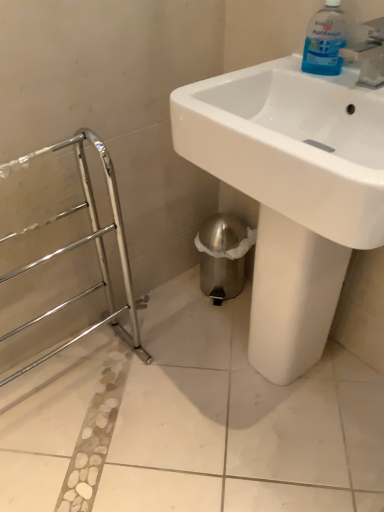
Where is `white glossy sink at center`? Image resolution: width=384 pixels, height=512 pixels. white glossy sink at center is located at coordinates (292, 191).

The height and width of the screenshot is (512, 384). Describe the element at coordinates (292, 191) in the screenshot. I see `white glossy sink at center` at that location.

Measure the distance between point (230, 102) and camera.

Point (230, 102) and camera are 37.72 inches apart from each other.

Describe the element at coordinates (325, 41) in the screenshot. This screenshot has width=384, height=512. I see `blue translucent plastic handwash at upper right` at that location.

In order to face blue translucent plastic handwash at upper right, should I rotate leftwards or rightwards?

You should look right and rotate roughly 17.604 degrees.

Measure the distance between point (337,19) and camera.

Point (337,19) and camera are 95.20 centimeters apart.

At what (x,y) coordinates should I click in order to perform the action: click on blue translucent plastic handwash at upper right. Please return your answer as a coordinate pair (x, y). Looking at the image, I should click on (325, 41).

Find the location of `white glossy sink at center`. white glossy sink at center is located at coordinates (292, 191).

Considering the positions of objects white glossy sink at center and blue translucent plastic handwash at upper right in the image provided, who is more to the right, white glossy sink at center or blue translucent plastic handwash at upper right?

From the viewer's perspective, blue translucent plastic handwash at upper right appears more on the right side.

Is white glossy sink at center further to camera compared to blue translucent plastic handwash at upper right?

No, white glossy sink at center is closer to the viewer.

Does point (235, 162) come closer to viewer compared to point (339, 34)?

That is True.

Looking at this image, from the image's perspective, is white glossy sink at center on top of blue translucent plastic handwash at upper right?

No, from the image's perspective, white glossy sink at center is not over blue translucent plastic handwash at upper right.

From a real-world perspective, who is located higher, white glossy sink at center or blue translucent plastic handwash at upper right?

In real-world perspective, blue translucent plastic handwash at upper right is above.

Considering the relative sizes of white glossy sink at center and blue translucent plastic handwash at upper right in the image provided, is white glossy sink at center wider than blue translucent plastic handwash at upper right?

Indeed, white glossy sink at center has a greater width compared to blue translucent plastic handwash at upper right.

Which of these two, white glossy sink at center or blue translucent plastic handwash at upper right, stands shorter?

blue translucent plastic handwash at upper right is shorter.

Between white glossy sink at center and blue translucent plastic handwash at upper right, which one has smaller size?

Smaller between the two is blue translucent plastic handwash at upper right.

Is blue translucent plastic handwash at upper right completely or partially inside white glossy sink at center?

Yes, blue translucent plastic handwash at upper right is inside white glossy sink at center.

Are white glossy sink at center and blue translucent plastic handwash at upper right making contact?

No, white glossy sink at center is not touching blue translucent plastic handwash at upper right.

Does white glossy sink at center turn towards blue translucent plastic handwash at upper right?

No, white glossy sink at center is not facing towards blue translucent plastic handwash at upper right.

You are a GUI agent. You are given a task and a screenshot of the screen. Output one action in this format:
    pyautogui.click(x=<x>, y=<y>)
    Task: Click on the cleaning product on the right of white glossy sink at center
    This screenshot has width=384, height=512.
    Given the screenshot: What is the action you would take?
    pyautogui.click(x=325, y=41)

Can you confirm if blue translucent plastic handwash at upper right is positioned to the left of white glossy sink at center?

Incorrect, blue translucent plastic handwash at upper right is not on the left side of white glossy sink at center.

Does blue translucent plastic handwash at upper right come behind white glossy sink at center?

Yes, it is.

Which is in front, point (333, 42) or point (343, 226)?

The point (343, 226) is in front.

From the image's perspective, is blue translucent plastic handwash at upper right above or below white glossy sink at center?

blue translucent plastic handwash at upper right is above white glossy sink at center.

From a real-world perspective, which is physically below, blue translucent plastic handwash at upper right or white glossy sink at center?

From a 3D spatial view, white glossy sink at center is below.

Is blue translucent plastic handwash at upper right wider or thinner than white glossy sink at center?

In the image, blue translucent plastic handwash at upper right appears to be more narrow than white glossy sink at center.

Considering the sizes of objects blue translucent plastic handwash at upper right and white glossy sink at center in the image provided, who is taller, blue translucent plastic handwash at upper right or white glossy sink at center?

Standing taller between the two is white glossy sink at center.

From the picture: Who is smaller, blue translucent plastic handwash at upper right or white glossy sink at center?

blue translucent plastic handwash at upper right is smaller.

Is blue translucent plastic handwash at upper right not inside white glossy sink at center?

No, blue translucent plastic handwash at upper right is not entirely external to white glossy sink at center.

Is blue translucent plastic handwash at upper right placed right next to white glossy sink at center?

blue translucent plastic handwash at upper right and white glossy sink at center are clearly separated.

Is blue translucent plastic handwash at upper right oriented away from white glossy sink at center?

That's right, blue translucent plastic handwash at upper right is facing away from white glossy sink at center.

Can you tell me how much blue translucent plastic handwash at upper right and white glossy sink at center differ in facing direction?

The facing directions of blue translucent plastic handwash at upper right and white glossy sink at center are 1.21 degrees apart.

How distant is blue translucent plastic handwash at upper right from white glossy sink at center?

They are 13.74 inches apart.

The image size is (384, 512). Identify the location of sink on the left of blue translucent plastic handwash at upper right. (292, 191).

Image resolution: width=384 pixels, height=512 pixels. Find the location of `sink below the blue translucent plastic handwash at upper right (from the image's perspective)`. sink below the blue translucent plastic handwash at upper right (from the image's perspective) is located at coordinates (292, 191).

Where is `cleaning product positioned vertically above the white glossy sink at center (from a real-world perspective)`? This screenshot has height=512, width=384. cleaning product positioned vertically above the white glossy sink at center (from a real-world perspective) is located at coordinates (325, 41).